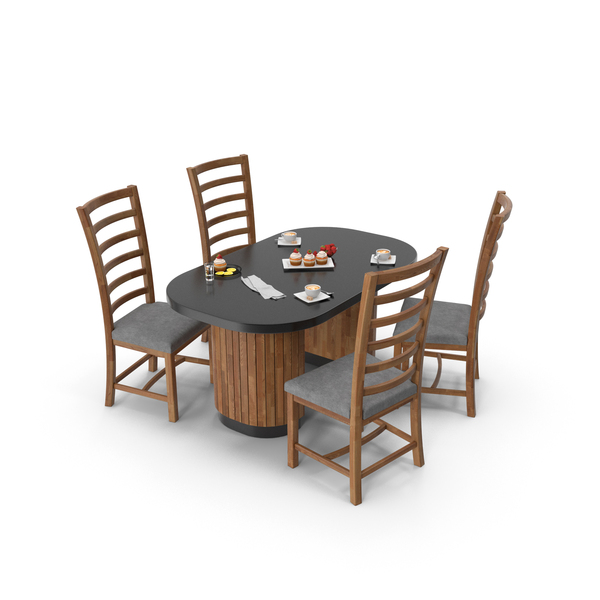
Image resolution: width=600 pixels, height=600 pixels. Find the location of `table`. table is located at coordinates click(x=283, y=315).